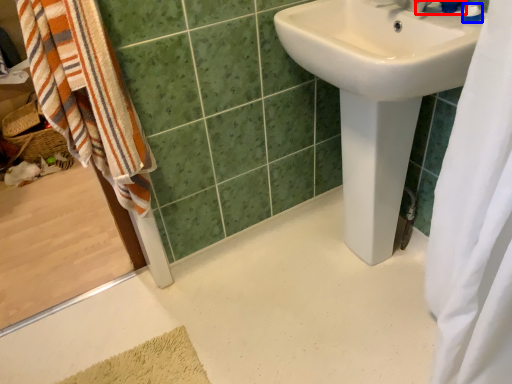
Question: Among these objects, which one is farthest to the camera, plumbing fixture (highlighted by a red box) or toiletry (highlighted by a blue box)?

Choices:
 (A) plumbing fixture
 (B) toiletry

Answer: (B)